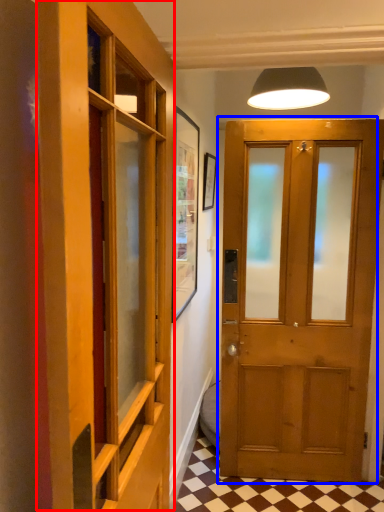
Question: Among these objects, which one is nearest to the camera, elevator (highlighted by a red box) or door (highlighted by a blue box)?

Choices:
 (A) elevator
 (B) door

Answer: (A)